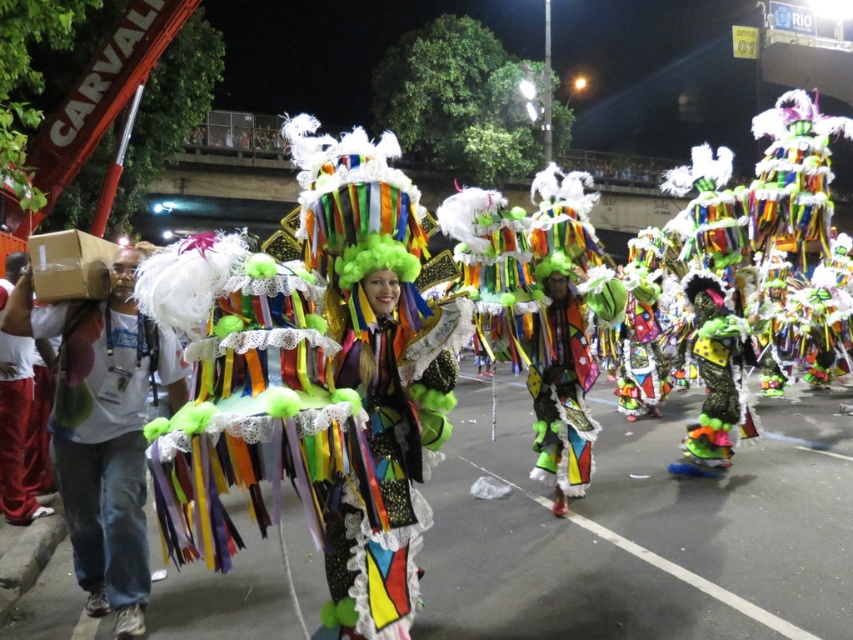
Question: Does brown cardboard box at left appear on the left side of velvet red pants at left?

Choices:
 (A) yes
 (B) no

Answer: (B)

Question: Which point is closer to the camera?

Choices:
 (A) (148, 349)
 (B) (1, 317)

Answer: (B)

Question: Can you confirm if brown cardboard box at left is wider than velvet red pants at left?

Choices:
 (A) yes
 (B) no

Answer: (A)

Question: Which object appears farthest from the camera in this image?

Choices:
 (A) velvet red pants at left
 (B) brown cardboard box at left

Answer: (A)

Question: Does brown cardboard box at left have a greater width compared to velvet red pants at left?

Choices:
 (A) yes
 (B) no

Answer: (A)